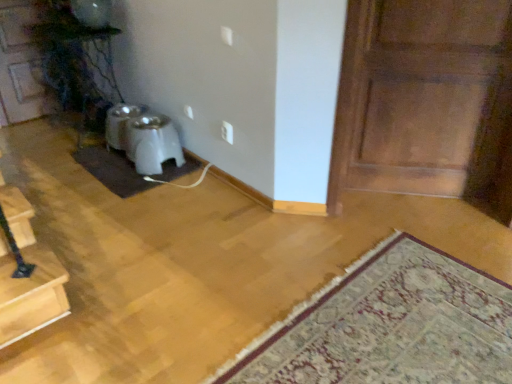
Question: Does white plastic electric outlet at center have a lesser width compared to white plastic pet feeder at center?

Choices:
 (A) yes
 (B) no

Answer: (A)

Question: From a real-world perspective, is white plastic electric outlet at center located beneath white plastic pet feeder at center?

Choices:
 (A) no
 (B) yes

Answer: (A)

Question: From a real-world perspective, is white plastic electric outlet at center located higher than white plastic pet feeder at center?

Choices:
 (A) no
 (B) yes

Answer: (B)

Question: Can you confirm if white plastic electric outlet at center is smaller than white plastic pet feeder at center?

Choices:
 (A) yes
 (B) no

Answer: (A)

Question: Considering the relative sizes of white plastic electric outlet at center and white plastic pet feeder at center in the image provided, is white plastic electric outlet at center taller than white plastic pet feeder at center?

Choices:
 (A) yes
 (B) no

Answer: (B)

Question: In the image, is white plastic pet feeder at center on the left side or the right side of carpeted rug at lower right?

Choices:
 (A) right
 (B) left

Answer: (B)

Question: From a real-world perspective, is white plastic pet feeder at center positioned above or below carpeted rug at lower right?

Choices:
 (A) below
 (B) above

Answer: (B)

Question: From the image's perspective, is white plastic pet feeder at center above or below carpeted rug at lower right?

Choices:
 (A) above
 (B) below

Answer: (A)

Question: Does point (155, 137) appear closer or farther from the camera than point (386, 377)?

Choices:
 (A) closer
 (B) farther

Answer: (B)

Question: Looking at their shapes, would you say wooden door at upper left, which is the 2th door from right to left, is wider or thinner than brown felt doormat at lower left?

Choices:
 (A) thin
 (B) wide

Answer: (A)

Question: From the image's perspective, is wooden door at upper left, arranged as the first door when viewed from the back, located above or below brown felt doormat at lower left?

Choices:
 (A) above
 (B) below

Answer: (A)

Question: In the image, is wooden door at upper left, which is the 2th door from right to left, positioned in front of or behind brown felt doormat at lower left?

Choices:
 (A) front
 (B) behind

Answer: (B)

Question: Considering the positions of wooden door at upper left, which is the 2th door from right to left, and brown felt doormat at lower left in the image, is wooden door at upper left, which is the 2th door from right to left, taller or shorter than brown felt doormat at lower left?

Choices:
 (A) short
 (B) tall

Answer: (B)

Question: Is point (180, 160) positioned closer to the camera than point (330, 185)?

Choices:
 (A) closer
 (B) farther

Answer: (B)

Question: Choose the correct answer: Is white plastic pet feeder at center inside wooden panel door at right, marked as the 2th door in a back-to-front arrangement, or outside it?

Choices:
 (A) outside
 (B) inside

Answer: (A)